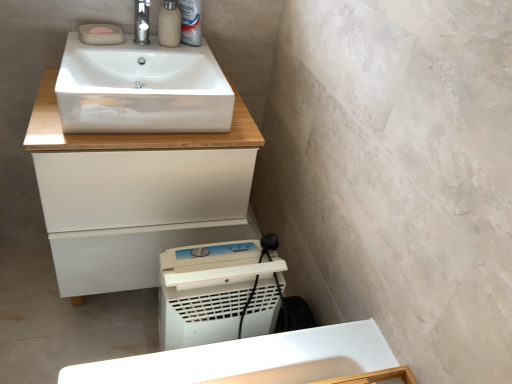
Question: Does matte beige soap dispenser at upper center lie behind white plastic can at upper center?

Choices:
 (A) yes
 (B) no

Answer: (B)

Question: Considering the relative sizes of matte beige soap dispenser at upper center and white plastic can at upper center in the image provided, is matte beige soap dispenser at upper center thinner than white plastic can at upper center?

Choices:
 (A) yes
 (B) no

Answer: (B)

Question: Are matte beige soap dispenser at upper center and white plastic can at upper center located far from each other?

Choices:
 (A) no
 (B) yes

Answer: (A)

Question: From the image's perspective, is matte beige soap dispenser at upper center beneath white plastic can at upper center?

Choices:
 (A) no
 (B) yes

Answer: (B)

Question: Is matte beige soap dispenser at upper center touching white plastic can at upper center?

Choices:
 (A) no
 (B) yes

Answer: (B)

Question: From their relative heights in the image, would you say white glossy sink at upper center is taller or shorter than white glossy cabinet at upper center?

Choices:
 (A) tall
 (B) short

Answer: (B)

Question: Choose the correct answer: Is white glossy sink at upper center inside white glossy cabinet at upper center or outside it?

Choices:
 (A) outside
 (B) inside

Answer: (A)

Question: Does point (158, 44) appear closer or farther from the camera than point (179, 135)?

Choices:
 (A) closer
 (B) farther

Answer: (B)

Question: Visually, is white glossy sink at upper center positioned to the left or to the right of white glossy cabinet at upper center?

Choices:
 (A) left
 (B) right

Answer: (B)

Question: In terms of width, does polished chrome tap at upper center look wider or thinner when compared to white glossy cabinet at upper center?

Choices:
 (A) wide
 (B) thin

Answer: (B)

Question: In terms of height, does polished chrome tap at upper center look taller or shorter compared to white glossy cabinet at upper center?

Choices:
 (A) tall
 (B) short

Answer: (B)

Question: Do you think polished chrome tap at upper center is within white glossy cabinet at upper center, or outside of it?

Choices:
 (A) outside
 (B) inside

Answer: (A)

Question: In terms of size, does polished chrome tap at upper center appear bigger or smaller than white glossy cabinet at upper center?

Choices:
 (A) big
 (B) small

Answer: (B)

Question: From the image's perspective, is white plastic washing machine at lower center positioned above or below white glossy cabinet at upper center?

Choices:
 (A) above
 (B) below

Answer: (B)

Question: Is white plastic washing machine at lower center to the left or to the right of white glossy cabinet at upper center in the image?

Choices:
 (A) left
 (B) right

Answer: (B)